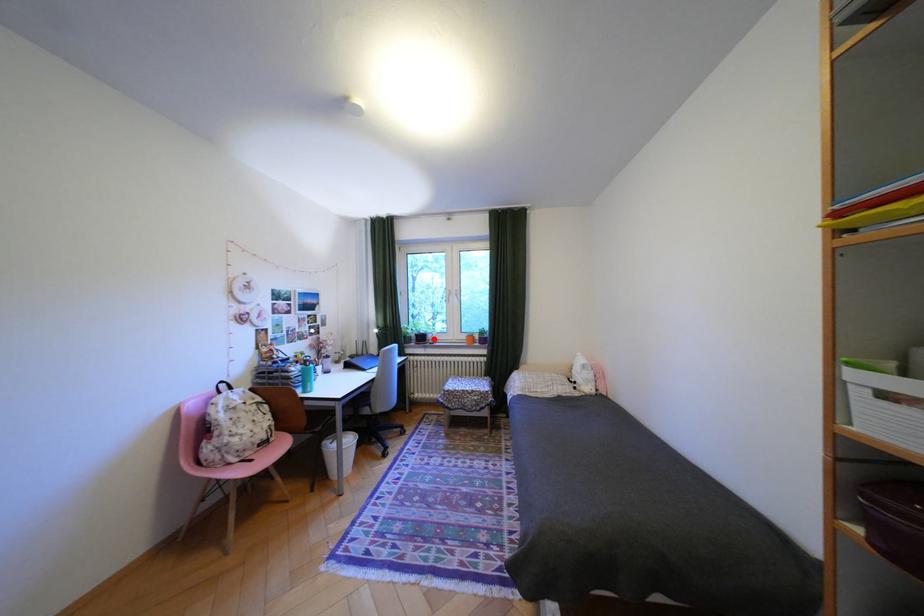
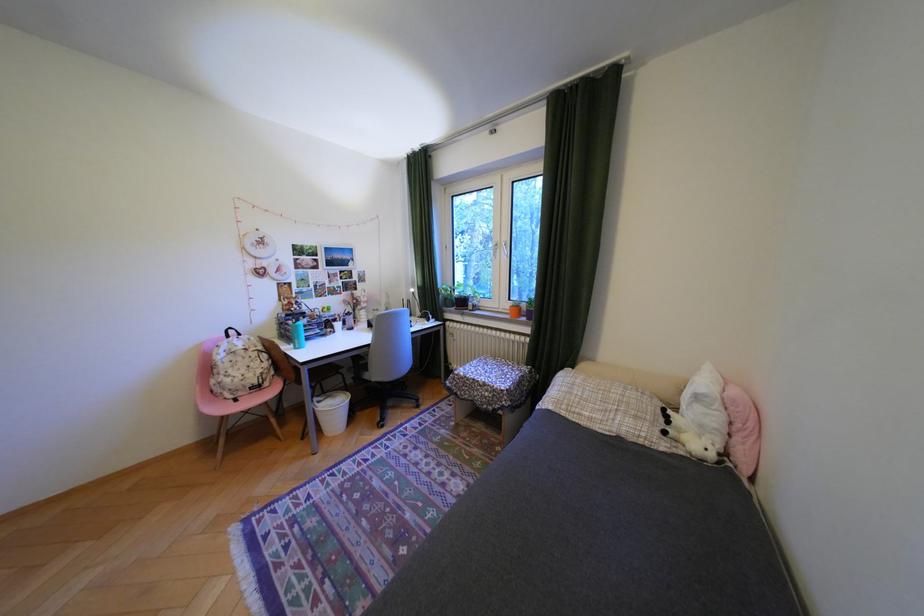
Locate, in the second image, the point that corresponds to the highlighted location in the first image.

(475, 302)